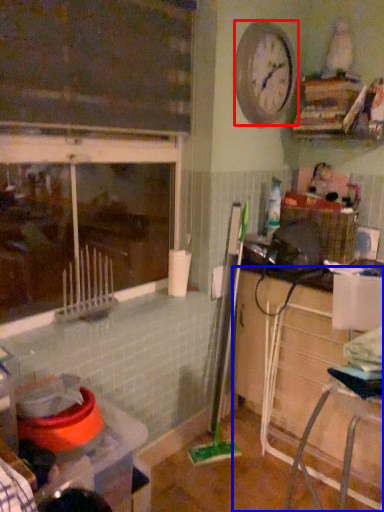
Question: Which object appears farthest to the camera in this image, clock (highlighted by a red box) or cabinetry (highlighted by a blue box)?

Choices:
 (A) clock
 (B) cabinetry

Answer: (A)